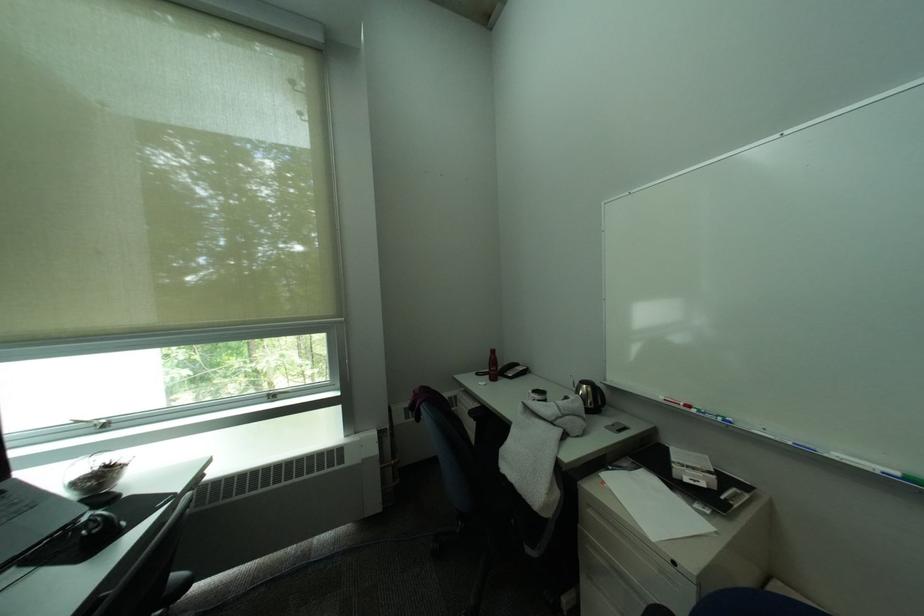
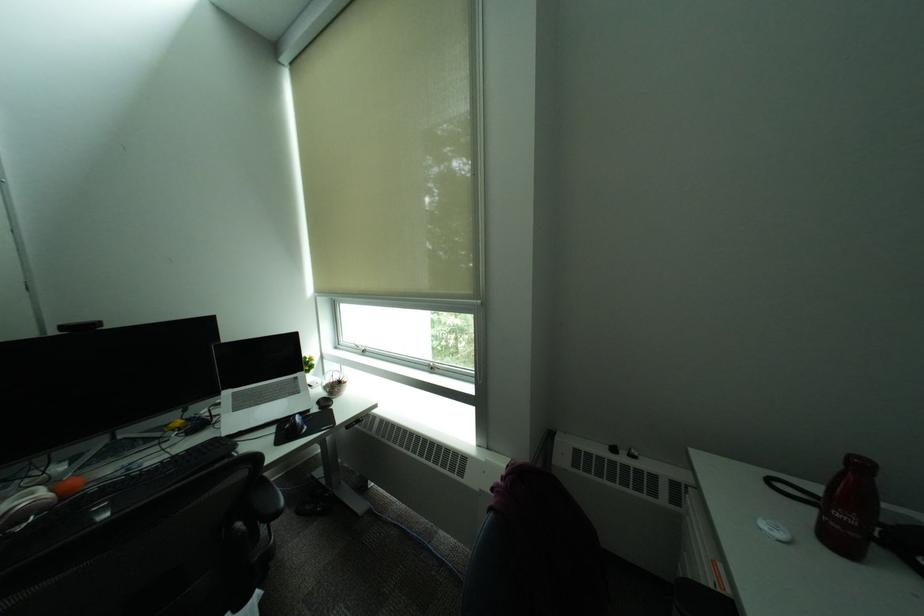
Question: The first image is from the beginning of the video and the second image is from the end. How did the camera likely rotate when shooting the video?

Choices:
 (A) Left
 (B) Right
 (C) Up
 (D) Down

Answer: (A)